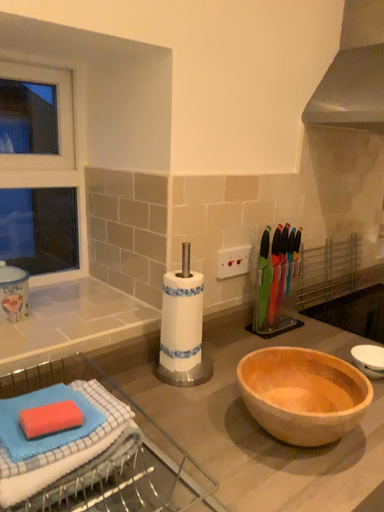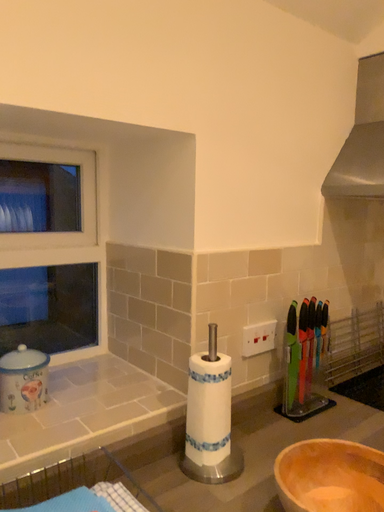
Question: How did the camera likely rotate when shooting the video?

Choices:
 (A) rotated downward
 (B) rotated upward

Answer: (B)